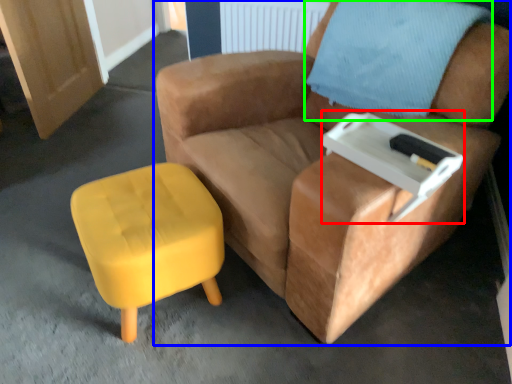
Question: Based on their relative distances, which object is farther from side table (highlighted by a red box)? Choose from chair (highlighted by a blue box) and pillow (highlighted by a green box).

Choices:
 (A) chair
 (B) pillow

Answer: (B)